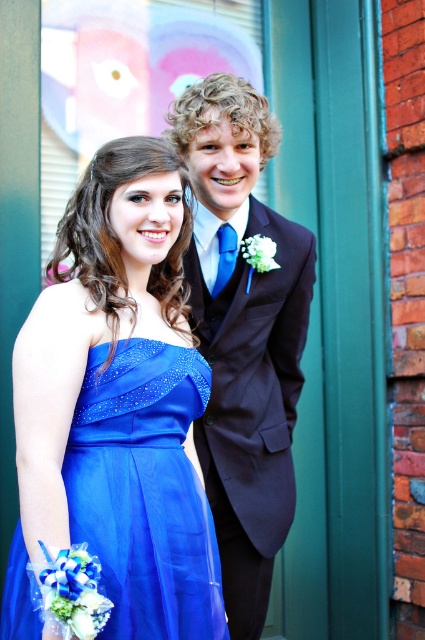
Question: Can you confirm if shiny dark suit at center is wider than blue satin dress at center?

Choices:
 (A) no
 (B) yes

Answer: (B)

Question: Can you confirm if shiny dark suit at center is positioned below shiny blue dress at center?

Choices:
 (A) no
 (B) yes

Answer: (A)

Question: Which object is the farthest from the shiny blue dress at center?

Choices:
 (A) blue satin dress at center
 (B) shiny dark suit at center

Answer: (A)

Question: Can you confirm if shiny dark suit at center is positioned below shiny blue dress at center?

Choices:
 (A) no
 (B) yes

Answer: (A)

Question: Which object is the farthest from the shiny dark suit at center?

Choices:
 (A) blue satin dress at center
 (B) shiny blue dress at center

Answer: (B)

Question: Which object appears farthest from the camera in this image?

Choices:
 (A) blue satin dress at center
 (B) shiny blue dress at center

Answer: (A)